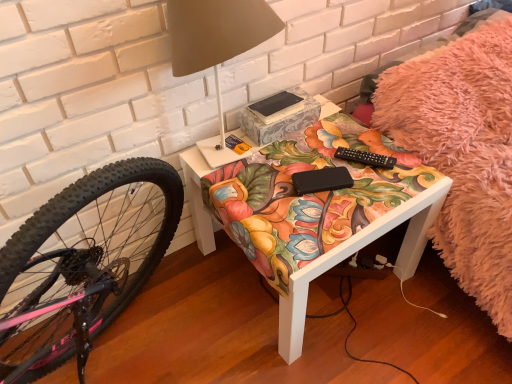
Identify the location of free space in front of matte white table lamp at upper center. (276, 213).